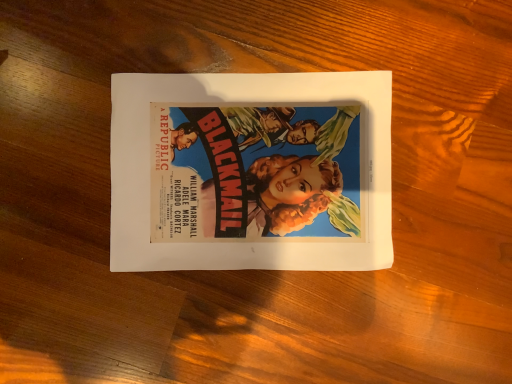
I want to click on vacant space situated above matte paper poster at center (from a real-world perspective), so click(x=247, y=167).